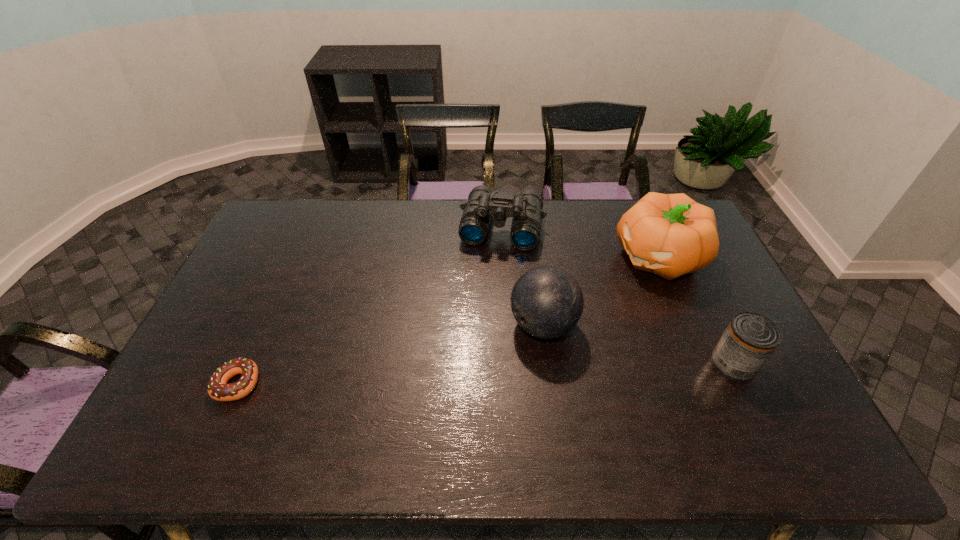
Locate an element on the screen. object that is at the left edge is located at coordinates (218, 389).

Identify the location of can present at the right edge. (750, 338).

You are a GUI agent. You are given a task and a screenshot of the screen. Output one action in this format:
    pyautogui.click(x=<x>, y=<y>)
    Task: Click on the pumpkin present at the right edge
    
    Given the screenshot: What is the action you would take?
    pyautogui.click(x=670, y=235)

You are a GUI agent. You are given a task and a screenshot of the screen. Output one action in this format:
    pyautogui.click(x=<x>, y=<y>)
    Task: Click on the object located at the near left corner
    Image resolution: width=960 pixels, height=540 pixels.
    Given the screenshot: What is the action you would take?
    pyautogui.click(x=218, y=389)

This screenshot has width=960, height=540. I want to click on object situated at the far right corner, so click(x=670, y=235).

I want to click on blank area at the far edge, so click(461, 219).

Identify the location of vacant space at the near edge of the desktop. [x=613, y=388].

You are a GUI agent. You are given a task and a screenshot of the screen. Output one action in this format:
    pyautogui.click(x=<x>, y=<y>)
    Task: Click on the vacant area at the left edge
    This screenshot has height=540, width=960.
    Given the screenshot: What is the action you would take?
    pyautogui.click(x=263, y=253)

In the image, there is a desktop. Where is `vacant space at the right edge`? vacant space at the right edge is located at coordinates (759, 380).

This screenshot has height=540, width=960. Identify the location of vacant region at the far left corner of the desktop. (269, 215).